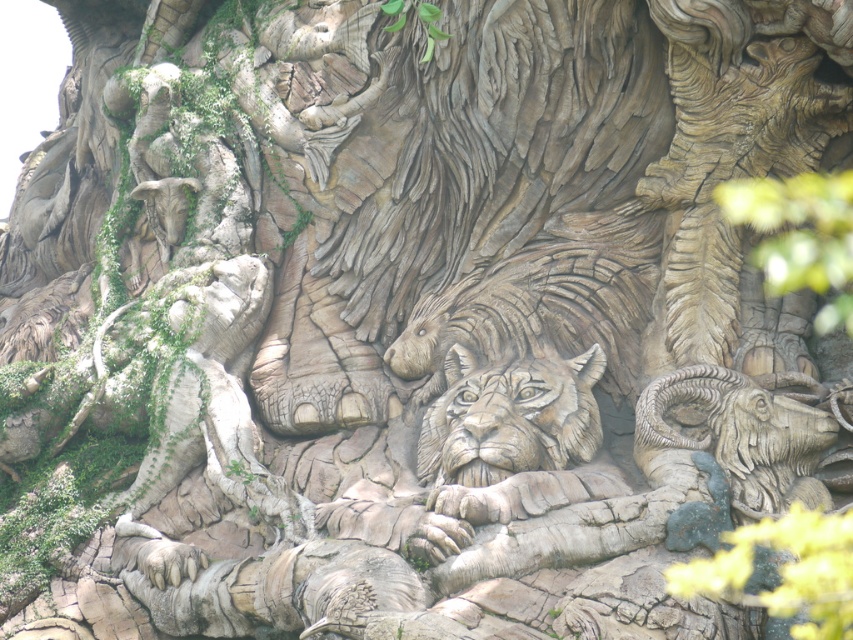
Question: Which of the following is the closest to the observer?

Choices:
 (A) carved stone ram at center
 (B) carved stone lion at center
 (C) wooden lion face at center
 (D) wooden carving of bird at upper left

Answer: (A)

Question: Among these objects, which one is farthest from the camera?

Choices:
 (A) carved stone lion at center
 (B) wooden lion face at center
 (C) wooden carving of bird at upper left

Answer: (C)

Question: Is carved stone ram at center further to the viewer compared to wooden lion face at center?

Choices:
 (A) no
 (B) yes

Answer: (A)

Question: Does carved stone lion at center appear over carved stone ram at center?

Choices:
 (A) yes
 (B) no

Answer: (A)

Question: Which of these objects is positioned closest to the carved stone ram at center?

Choices:
 (A) carved stone lion at center
 (B) wooden carving of bird at upper left
 (C) wooden lion face at center

Answer: (C)

Question: Does carved stone lion at center have a larger size compared to wooden carving of bird at upper left?

Choices:
 (A) no
 (B) yes

Answer: (B)